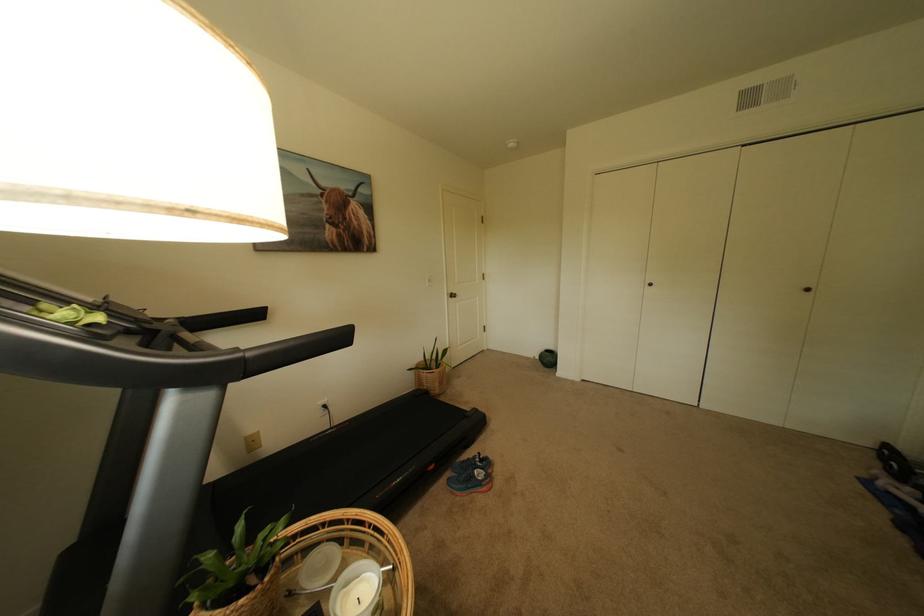
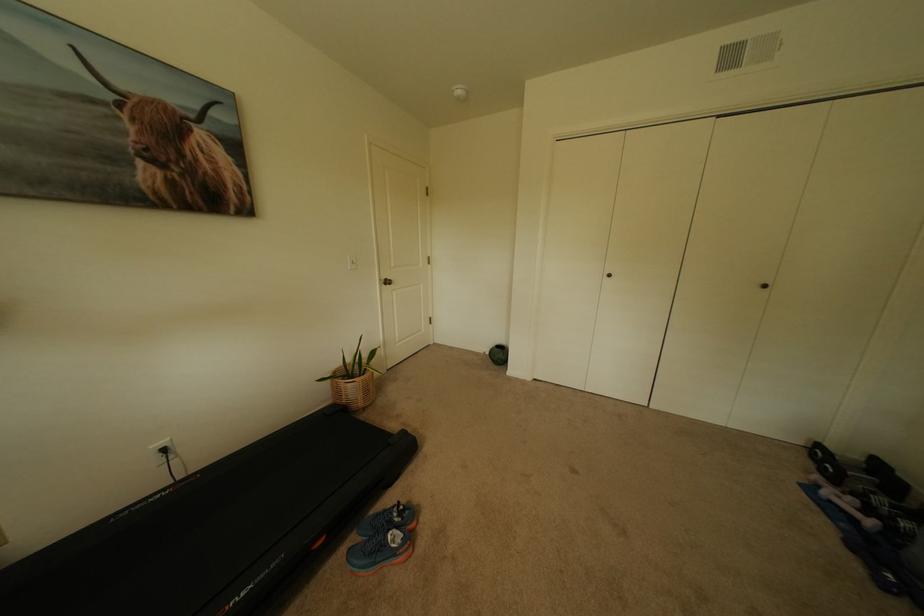
Where in the second image is the point corresponding to (x=894, y=453) from the first image?

(827, 452)